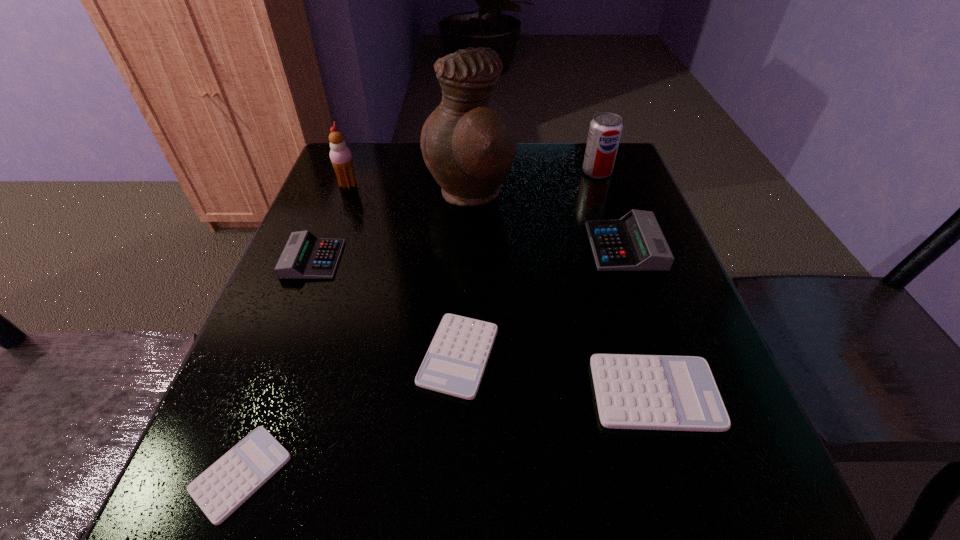
Where is `vacant space in between the icecream and the third calculator from left to right`? Image resolution: width=960 pixels, height=540 pixels. vacant space in between the icecream and the third calculator from left to right is located at coordinates (403, 271).

The image size is (960, 540). I want to click on free space between the tallest calculator and the biggest white calculator, so click(x=639, y=320).

Where is `vacant space that is in between the second white calculator from right to left and the soda`? The width and height of the screenshot is (960, 540). vacant space that is in between the second white calculator from right to left and the soda is located at coordinates pyautogui.click(x=528, y=264).

I want to click on free space between the biggest white calculator and the icecream, so click(501, 289).

The height and width of the screenshot is (540, 960). Identify the location of the third closest object relative to the pitcher. (340, 155).

Identify which object is the second closest to the third calculator from left to right. Please provide its 2D coordinates. Your answer should be formatted as a tuple, i.e. [(x, y)], where the tuple contains the x and y coordinates of a point satisfying the conditions above.

[(222, 488)]

Choose which calculator is the fifth nearest neighbor to the soda. Please provide its 2D coordinates. Your answer should be formatted as a tuple, i.e. [(x, y)], where the tuple contains the x and y coordinates of a point satisfying the conditions above.

[(222, 488)]

Point out which calculator is positioned as the second nearest to the leftmost white calculator. Please provide its 2D coordinates. Your answer should be formatted as a tuple, i.e. [(x, y)], where the tuple contains the x and y coordinates of a point satisfying the conditions above.

[(305, 256)]

Select which white calculator is the closest to the second shortest calculator. Please provide its 2D coordinates. Your answer should be formatted as a tuple, i.e. [(x, y)], where the tuple contains the x and y coordinates of a point satisfying the conditions above.

[(650, 392)]

Locate an element on the screen. white calculator that is the second nearest to the fifth tallest object is located at coordinates (222, 488).